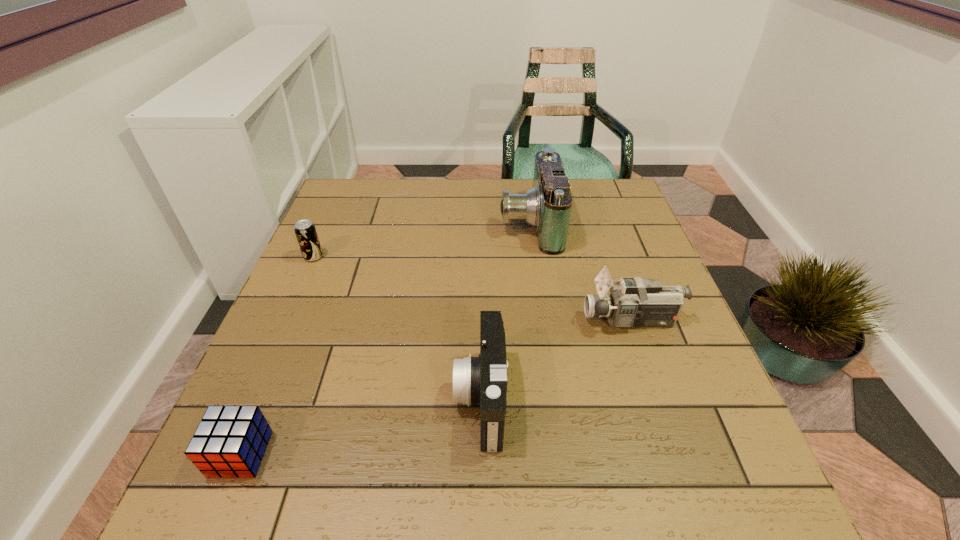
You are a GUI agent. You are given a task and a screenshot of the screen. Output one action in this format:
    pyautogui.click(x=<x>, y=<y>)
    Task: Click on the object present at the near edge
    This screenshot has width=960, height=540.
    Given the screenshot: What is the action you would take?
    (x=230, y=441)

You are a GUI agent. You are given a task and a screenshot of the screen. Output one action in this format:
    pyautogui.click(x=<x>, y=<y>)
    Task: Click on the soda can positioned at the left edge
    The image size is (960, 540).
    Given the screenshot: What is the action you would take?
    pyautogui.click(x=305, y=231)

You are a GUI agent. You are given a task and a screenshot of the screen. Output one action in this format:
    pyautogui.click(x=<x>, y=<y>)
    Task: Click on the cube present at the left edge
    This screenshot has width=960, height=540.
    Given the screenshot: What is the action you would take?
    pyautogui.click(x=230, y=441)

Identify the location of object situated at the right edge. (635, 302).

You are a GUI agent. You are given a task and a screenshot of the screen. Output one action in this format:
    pyautogui.click(x=<x>, y=<y>)
    Task: Click on the object present at the near left corner
    The height and width of the screenshot is (540, 960).
    Given the screenshot: What is the action you would take?
    pyautogui.click(x=230, y=441)

You are a GUI agent. You are given a task and a screenshot of the screen. Output one action in this format:
    pyautogui.click(x=<x>, y=<y>)
    Task: Click on the vacant area at the far edge
    
    Given the screenshot: What is the action you would take?
    pyautogui.click(x=388, y=208)

Identify the location of blank space at the near edge of the desktop. (502, 480).

The width and height of the screenshot is (960, 540). Identify the location of free space at the left edge of the desktop. (311, 424).

In the image, there is a desktop. At what (x,y) coordinates should I click in order to perform the action: click on vacant space at the right edge. Please return your answer as a coordinate pair (x, y). The width and height of the screenshot is (960, 540). Looking at the image, I should click on (624, 232).

The image size is (960, 540). What are the coordinates of `free space at the far left corner of the desktop` in the screenshot? It's located at (348, 204).